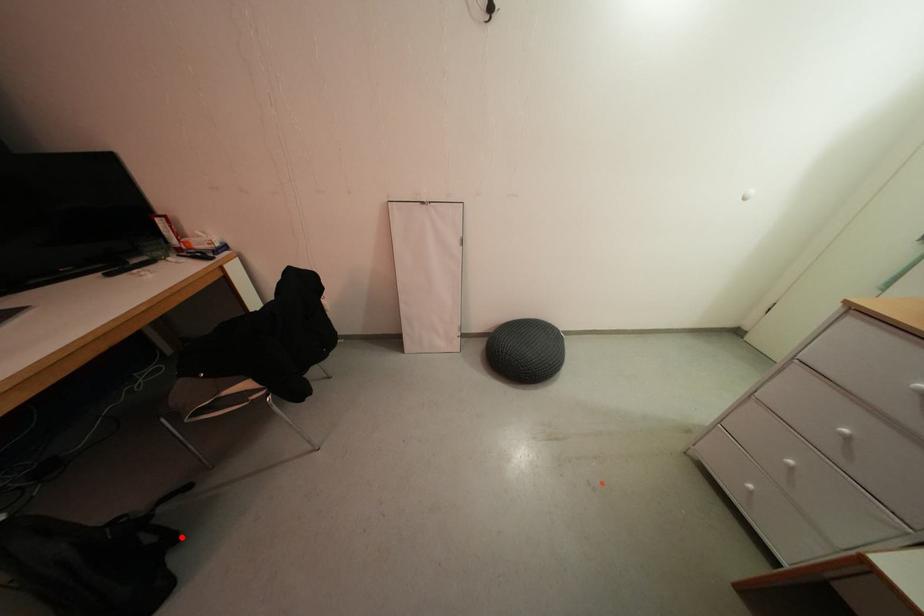
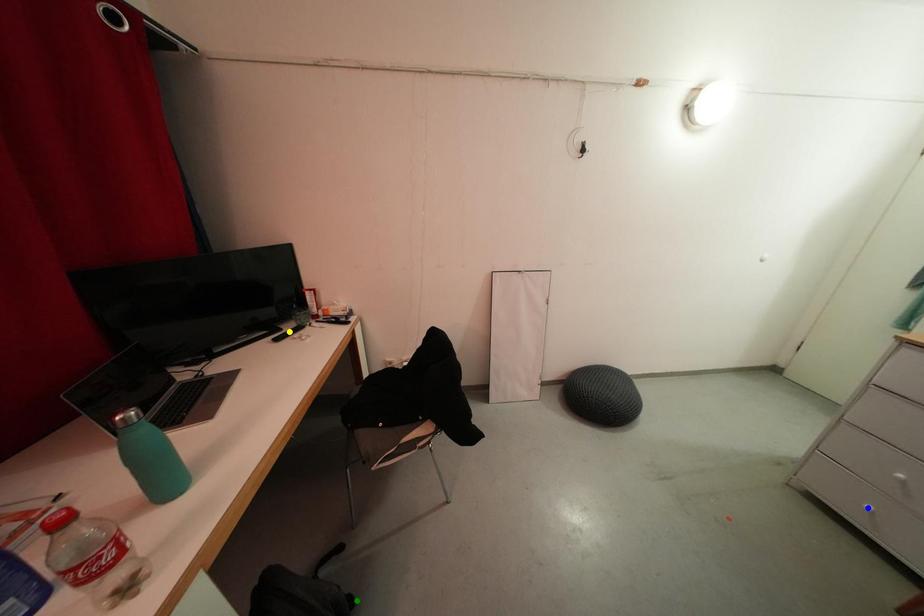
Question: I am providing you with two images of the same scene from different viewpoints. A red point is marked on the first image. You are given multiple points on the second image. Which mark in image 2 goes with the point in image 1?

Choices:
 (A) green point
 (B) yellow point
 (C) blue point

Answer: (A)